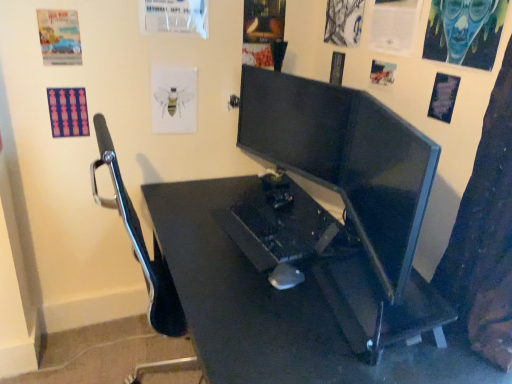
Locate an element on the screen. vacant space behind black plastic mouse at center is located at coordinates (281, 254).